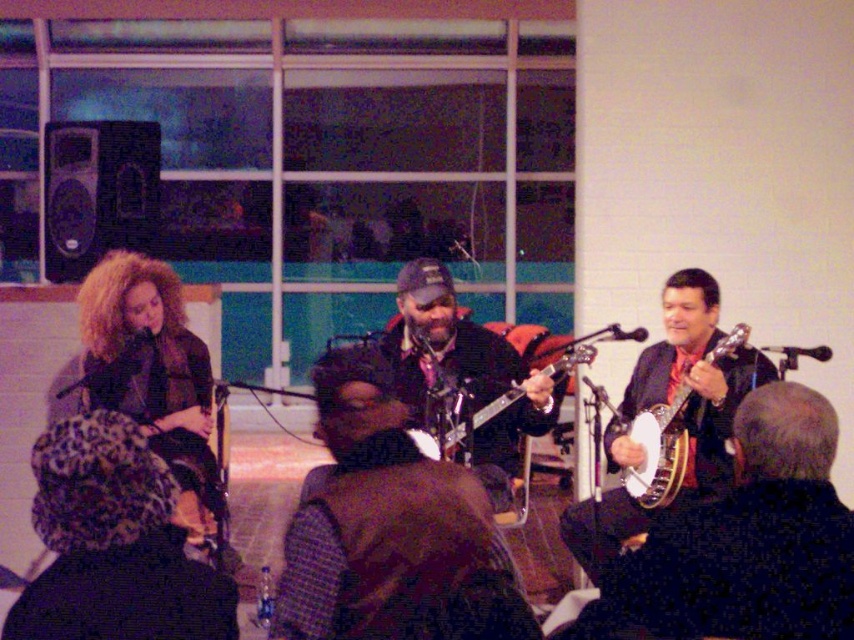
Does matte black banjo at center have a smaller size compared to glossy black banjo at center?

No.

Find the location of a particular element. matte black banjo at center is located at coordinates (143, 349).

Does matte black banjo at center have a greater height compared to shiny brown banjo at center?

In fact, matte black banjo at center may be shorter than shiny brown banjo at center.

Between matte black banjo at center and shiny brown banjo at center, which one appears on the left side from the viewer's perspective?

matte black banjo at center is more to the left.

This screenshot has height=640, width=854. Describe the element at coordinates (143, 349) in the screenshot. I see `matte black banjo at center` at that location.

The width and height of the screenshot is (854, 640). Identify the location of matte black banjo at center. (143, 349).

Does shiny black banjo at center appear on the left side of wooden banjo at right?

Correct, you'll find shiny black banjo at center to the left of wooden banjo at right.

Does shiny black banjo at center have a greater height compared to wooden banjo at right?

No, shiny black banjo at center is not taller than wooden banjo at right.

Between point (360, 548) and point (728, 340), which one is positioned in front?

Point (360, 548) is in front.

The image size is (854, 640). Identify the location of shiny black banjo at center. (390, 529).